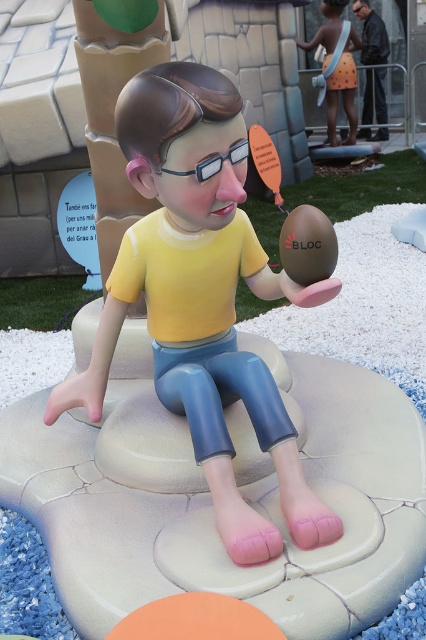
Question: Among these objects, which one is nearest to the camera?

Choices:
 (A) clear plastic goggles at center
 (B) orange fabric towel at upper right
 (C) leather jacket at upper right

Answer: (A)

Question: Does matte yellow shirt at center have a lesser width compared to orange fabric towel at upper right?

Choices:
 (A) yes
 (B) no

Answer: (B)

Question: From the image, what is the correct spatial relationship of orange fabric towel at upper right in relation to clear plastic goggles at center?

Choices:
 (A) right
 (B) left

Answer: (A)

Question: Is leather jacket at upper right positioned in front of clear plastic goggles at center?

Choices:
 (A) yes
 (B) no

Answer: (B)

Question: Estimate the real-world distances between objects in this image. Which object is closer to the leather jacket at upper right?

Choices:
 (A) matte yellow shirt at center
 (B) orange fabric towel at upper right

Answer: (B)

Question: Which object is closer to the camera taking this photo?

Choices:
 (A) clear plastic goggles at center
 (B) orange fabric towel at upper right
 (C) matte yellow shirt at center
 (D) leather jacket at upper right

Answer: (C)